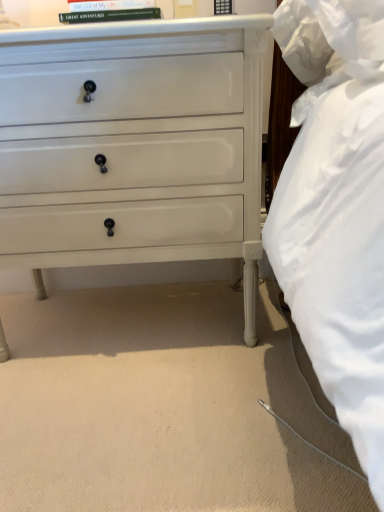
What do you see at coordinates (109, 11) in the screenshot? I see `hardcover book at upper center` at bounding box center [109, 11].

Identify the location of hardcover book at upper center. (109, 11).

Image resolution: width=384 pixels, height=512 pixels. In order to click on white painted wood chest of drawers at center in this screenshot , I will do `click(133, 146)`.

Describe the element at coordinates (133, 146) in the screenshot. I see `white painted wood chest of drawers at center` at that location.

Locate an element on the screen. hardcover book at upper center is located at coordinates (109, 11).

Is white painted wood chest of drawers at center at the left side of hardcover book at upper center?

Yes.

Which object is further away from the camera, white painted wood chest of drawers at center or hardcover book at upper center?

hardcover book at upper center.

Which point is more forward, [146,223] or [105,13]?

The point [105,13] is closer.

From the image's perspective, is white painted wood chest of drawers at center located beneath hardcover book at upper center?

Indeed, from the image's perspective, white painted wood chest of drawers at center is shown beneath hardcover book at upper center.

From a real-world perspective, does white painted wood chest of drawers at center stand above hardcover book at upper center?

Actually, white painted wood chest of drawers at center is physically below hardcover book at upper center in the real world.

Does white painted wood chest of drawers at center have a lesser width compared to hardcover book at upper center?

No, white painted wood chest of drawers at center is not thinner than hardcover book at upper center.

Between white painted wood chest of drawers at center and hardcover book at upper center, which one has less height?

With less height is hardcover book at upper center.

Considering the relative sizes of white painted wood chest of drawers at center and hardcover book at upper center in the image provided, is white painted wood chest of drawers at center bigger than hardcover book at upper center?

Correct, white painted wood chest of drawers at center is larger in size than hardcover book at upper center.

Is hardcover book at upper center surrounded by white painted wood chest of drawers at center?

No, hardcover book at upper center is not inside white painted wood chest of drawers at center.

Is white painted wood chest of drawers at center not near hardcover book at upper center?

white painted wood chest of drawers at center is actually quite close to hardcover book at upper center.

Is hardcover book at upper center at the back of white painted wood chest of drawers at center?

No.

Where is `book that is above the white painted wood chest of drawers at center (from the image's perspective)`? The width and height of the screenshot is (384, 512). book that is above the white painted wood chest of drawers at center (from the image's perspective) is located at coordinates (109, 11).

Between hardcover book at upper center and white painted wood chest of drawers at center, which one appears on the left side from the viewer's perspective?

white painted wood chest of drawers at center.

Which object is more forward, hardcover book at upper center or white painted wood chest of drawers at center?

white painted wood chest of drawers at center is closer to the camera.

Is point (105, 13) closer or farther from the camera than point (167, 24)?

Point (105, 13) is farther from the camera than point (167, 24).

From the image's perspective, does hardcover book at upper center appear lower than white painted wood chest of drawers at center?

Actually, hardcover book at upper center appears above white painted wood chest of drawers at center in the image.

From a real-world perspective, is hardcover book at upper center located beneath white painted wood chest of drawers at center?

Incorrect, from a real-world perspective, hardcover book at upper center is higher than white painted wood chest of drawers at center.

Does hardcover book at upper center have a greater width compared to white painted wood chest of drawers at center?

Incorrect, the width of hardcover book at upper center does not surpass that of white painted wood chest of drawers at center.

Can you confirm if hardcover book at upper center is taller than white painted wood chest of drawers at center?

In fact, hardcover book at upper center may be shorter than white painted wood chest of drawers at center.

Can you confirm if hardcover book at upper center is bigger than white painted wood chest of drawers at center?

No.

Which is correct: hardcover book at upper center is inside white painted wood chest of drawers at center, or outside of it?

The correct answer is: outside.

Is hardcover book at upper center not close to white painted wood chest of drawers at center?

No.

Does hardcover book at upper center turn towards white painted wood chest of drawers at center?

No, hardcover book at upper center is not turned towards white painted wood chest of drawers at center.

How different are the orientations of hardcover book at upper center and white painted wood chest of drawers at center in degrees?

hardcover book at upper center and white painted wood chest of drawers at center are facing 0.566 degrees away from each other.

Image resolution: width=384 pixels, height=512 pixels. I want to click on book that is behind the white painted wood chest of drawers at center, so click(x=109, y=11).

The image size is (384, 512). Find the location of `the chest of drawers in front of the hardcover book at upper center`. the chest of drawers in front of the hardcover book at upper center is located at coordinates (133, 146).

At what (x,y) coordinates should I click in order to perform the action: click on book located behind the white painted wood chest of drawers at center. Please return your answer as a coordinate pair (x, y). Image resolution: width=384 pixels, height=512 pixels. Looking at the image, I should click on (109, 11).